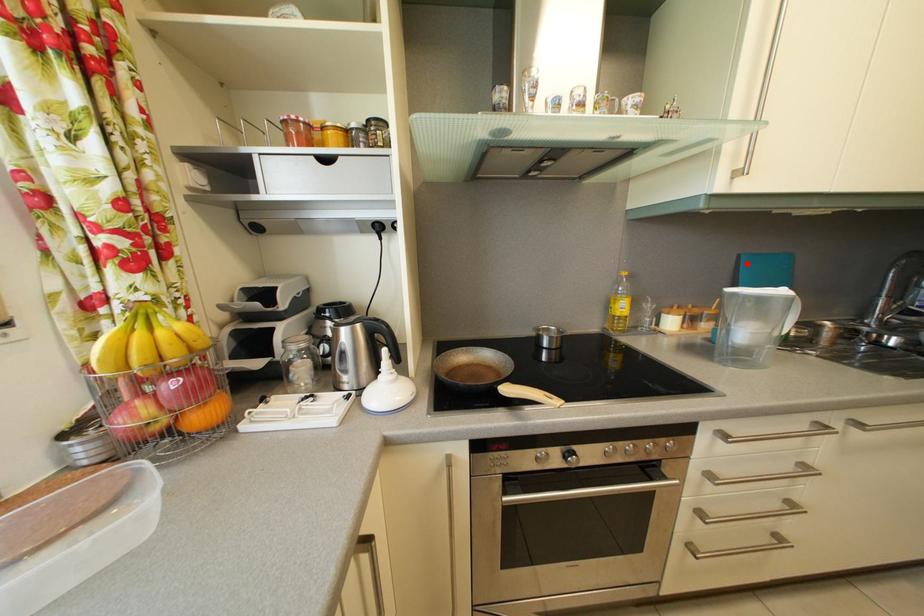
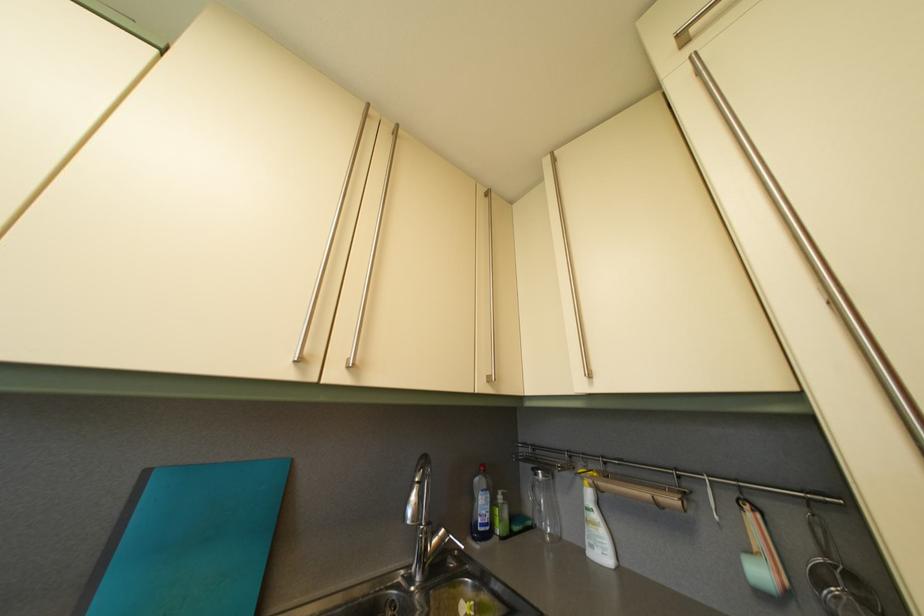
Question: I am providing you with two images of the same scene from different viewpoints. A red point is marked on the first image. Is the red point's position out of view in image 2?

Choices:
 (A) Yes
 (B) No

Answer: (B)